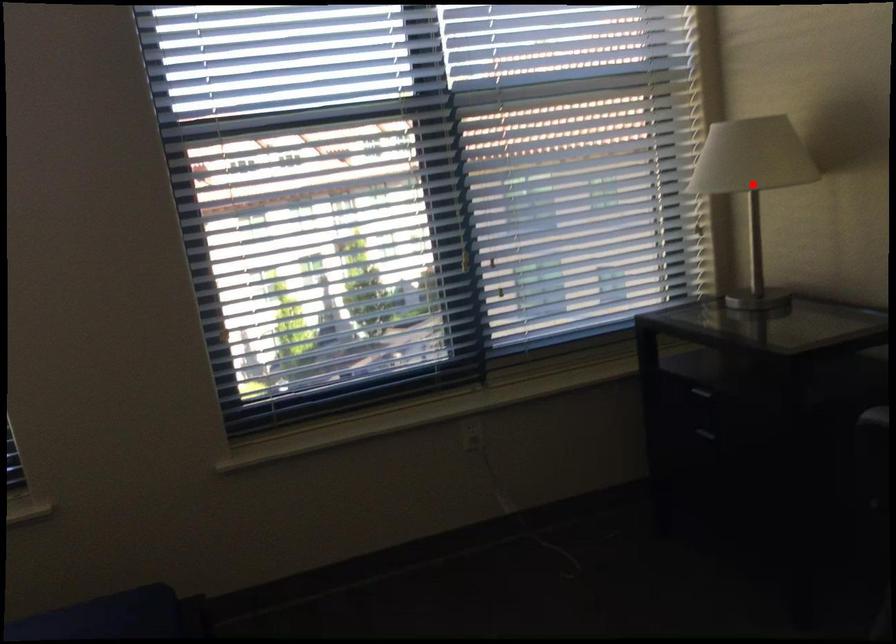
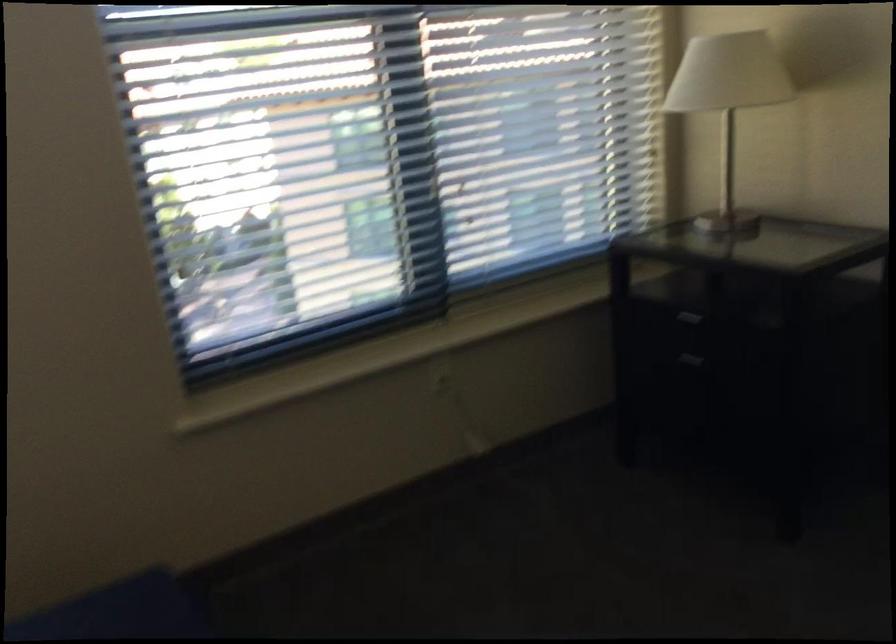
Question: I am providing you with two images of the same scene from different viewpoints. A red point is marked on the first image. At the location where the point appears in image 1, is it still visible in image 2?

Choices:
 (A) Yes
 (B) No

Answer: (B)